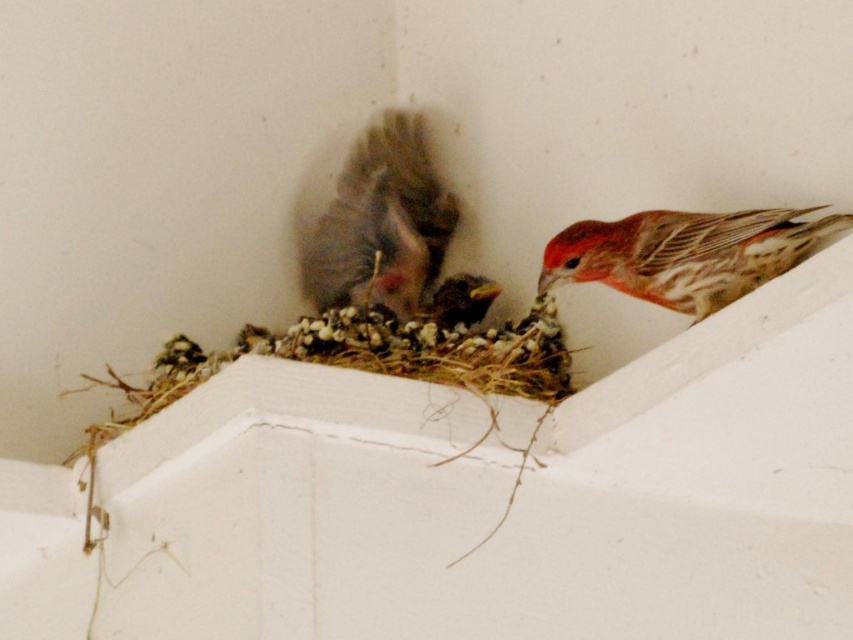
Question: Considering the relative positions of gray fluffy sparrow at center and reddish-brown speckled feathers at upper right in the image provided, where is gray fluffy sparrow at center located with respect to reddish-brown speckled feathers at upper right?

Choices:
 (A) below
 (B) above

Answer: (B)

Question: Which of the following is the closest to the observer?

Choices:
 (A) (729, 296)
 (B) (375, 292)

Answer: (A)

Question: Is the position of gray fluffy sparrow at center less distant than that of reddish-brown speckled feathers at upper right?

Choices:
 (A) no
 (B) yes

Answer: (A)

Question: Which of the following is the closest to the observer?

Choices:
 (A) gray fluffy sparrow at center
 (B) reddish-brown speckled feathers at upper right

Answer: (B)

Question: Is gray fluffy sparrow at center positioned before reddish-brown speckled feathers at upper right?

Choices:
 (A) yes
 (B) no

Answer: (B)